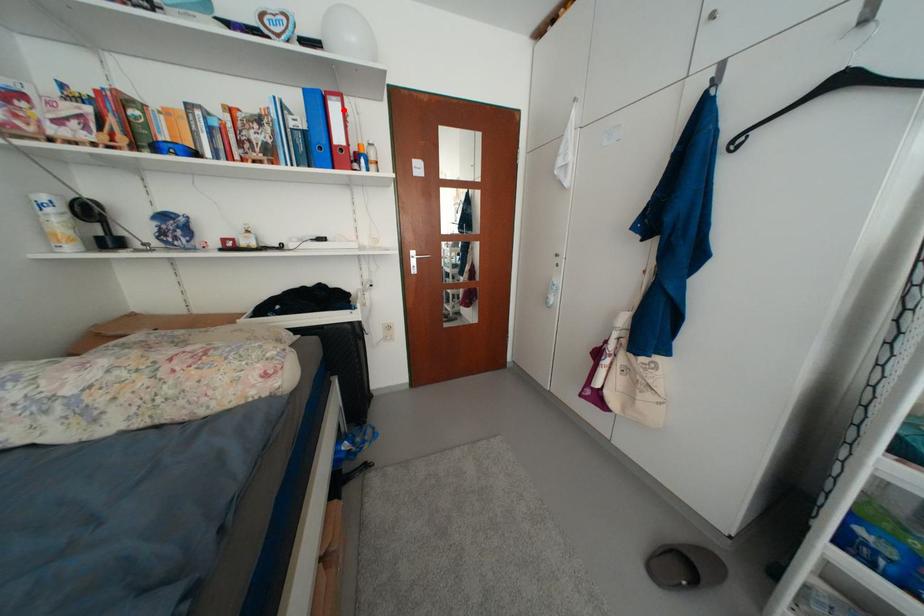
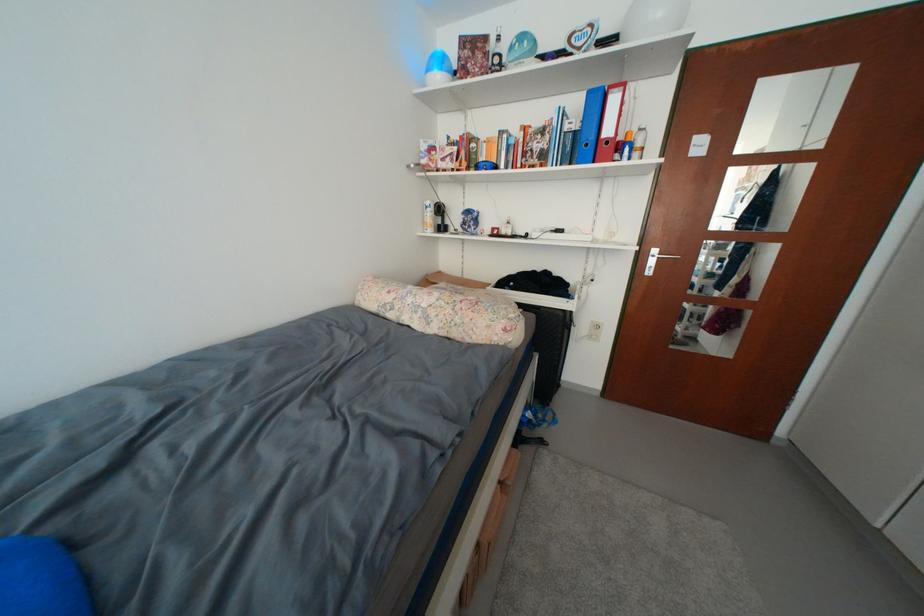
Where in the second image is the point corresponding to the highlighted location from the first image?

(623, 103)